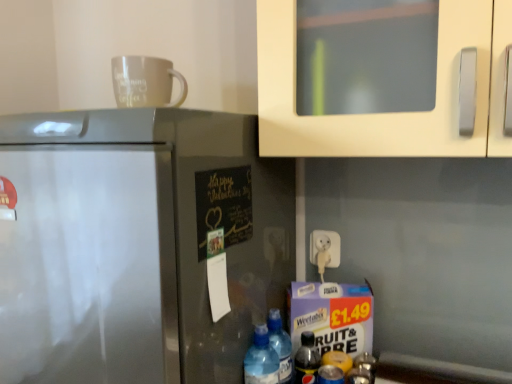
Question: Is matte white mug at upper center thinner than chalkboard paper at center?

Choices:
 (A) yes
 (B) no

Answer: (B)

Question: Considering the relative sizes of matte white mug at upper center and chalkboard paper at center in the image provided, is matte white mug at upper center bigger than chalkboard paper at center?

Choices:
 (A) yes
 (B) no

Answer: (A)

Question: Is chalkboard paper at center at the back of matte white mug at upper center?

Choices:
 (A) no
 (B) yes

Answer: (A)

Question: Is matte white mug at upper center to the right of chalkboard paper at center from the viewer's perspective?

Choices:
 (A) yes
 (B) no

Answer: (B)

Question: Is matte white mug at upper center positioned before chalkboard paper at center?

Choices:
 (A) yes
 (B) no

Answer: (B)

Question: Do you think satin silver refrigerator at left is within matte white mug at upper center, or outside of it?

Choices:
 (A) inside
 (B) outside

Answer: (B)

Question: Looking at their shapes, would you say satin silver refrigerator at left is wider or thinner than matte white mug at upper center?

Choices:
 (A) thin
 (B) wide

Answer: (B)

Question: Is satin silver refrigerator at left in front of or behind matte white mug at upper center in the image?

Choices:
 (A) front
 (B) behind

Answer: (A)

Question: Based on their sizes in the image, would you say satin silver refrigerator at left is bigger or smaller than matte white mug at upper center?

Choices:
 (A) big
 (B) small

Answer: (A)

Question: Is white plastic plug at lower center wider or thinner than translucent plastic bottles at lower center, which ranks as the first bottle in left-to-right order?

Choices:
 (A) wide
 (B) thin

Answer: (B)

Question: Based on their sizes in the image, would you say white plastic plug at lower center is bigger or smaller than translucent plastic bottles at lower center, which ranks as the first bottle in left-to-right order?

Choices:
 (A) big
 (B) small

Answer: (B)

Question: In the image, is white plastic plug at lower center positioned in front of or behind translucent plastic bottles at lower center, which ranks as the first bottle in left-to-right order?

Choices:
 (A) front
 (B) behind

Answer: (B)

Question: From the image's perspective, relative to translucent plastic bottles at lower center, the 4th bottle from the right, is white plastic plug at lower center above or below?

Choices:
 (A) below
 (B) above

Answer: (B)

Question: Considering their positions, is translucent plastic bottle at lower right, marked as the 4th bottle in a left-to-right arrangement, located in front of or behind chalkboard paper at center?

Choices:
 (A) front
 (B) behind

Answer: (B)

Question: Is translucent plastic bottle at lower right, the 1th bottle from the right, to the left or to the right of chalkboard paper at center in the image?

Choices:
 (A) left
 (B) right

Answer: (B)